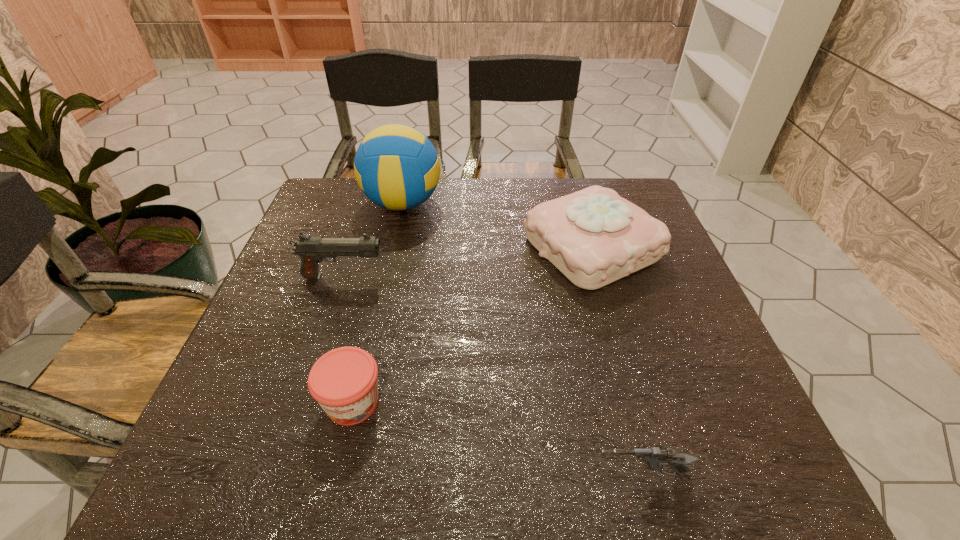
This screenshot has height=540, width=960. I want to click on vacant space located 0.120m on the front of the cake, so click(617, 335).

Locate an element on the screen. Image resolution: width=960 pixels, height=540 pixels. vacant space located 0.090m on the front label of the second shortest object is located at coordinates (333, 485).

Image resolution: width=960 pixels, height=540 pixels. I want to click on vacant space located at the barrel of the shorter gun, so click(414, 473).

This screenshot has height=540, width=960. I want to click on vacant space situated 0.240m at the barrel of the shorter gun, so click(x=445, y=473).

What are the coordinates of `vacant space situated at the barrel of the shorter gun` in the screenshot? It's located at (414, 473).

Locate an element on the screen. This screenshot has width=960, height=540. volleyball present at the far edge is located at coordinates (396, 166).

Where is `cake at the far edge`? This screenshot has height=540, width=960. cake at the far edge is located at coordinates (594, 237).

This screenshot has height=540, width=960. Identify the location of object positioned at the near edge. (655, 458).

Identify the location of volleyball present at the left edge. Image resolution: width=960 pixels, height=540 pixels. (396, 166).

Locate an element on the screen. Image resolution: width=960 pixels, height=540 pixels. gun that is at the left edge is located at coordinates (312, 250).